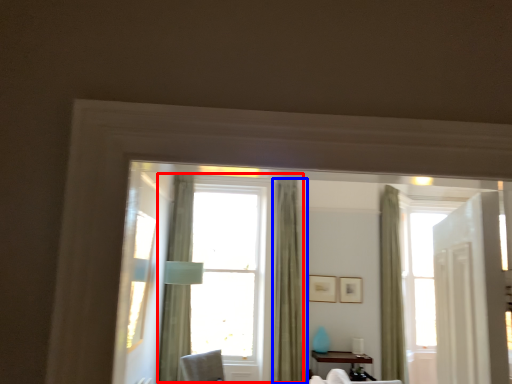
Question: Which object appears closest to the camera in this image, window (highlighted by a red box) or curtain (highlighted by a blue box)?

Choices:
 (A) window
 (B) curtain

Answer: (B)